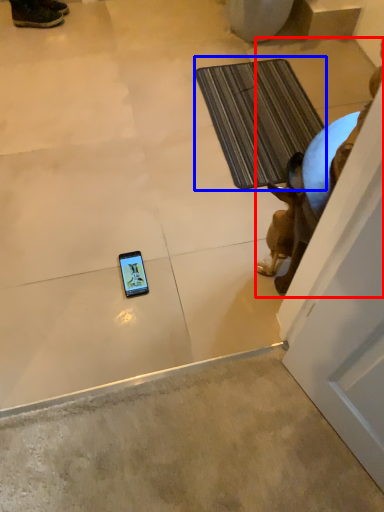
Question: Which object is closer to the camera taking this photo, animal (highlighted by a red box) or bath mat (highlighted by a blue box)?

Choices:
 (A) animal
 (B) bath mat

Answer: (A)